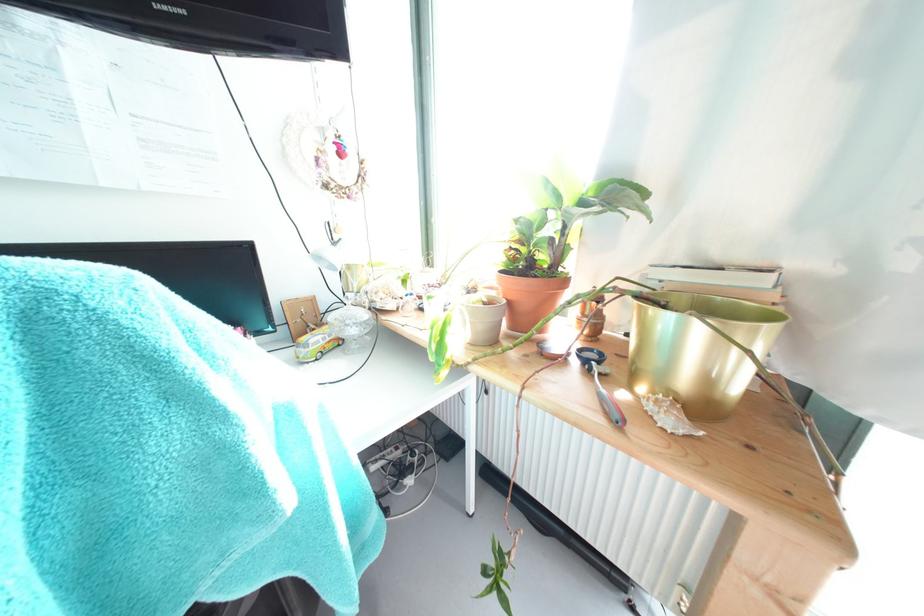
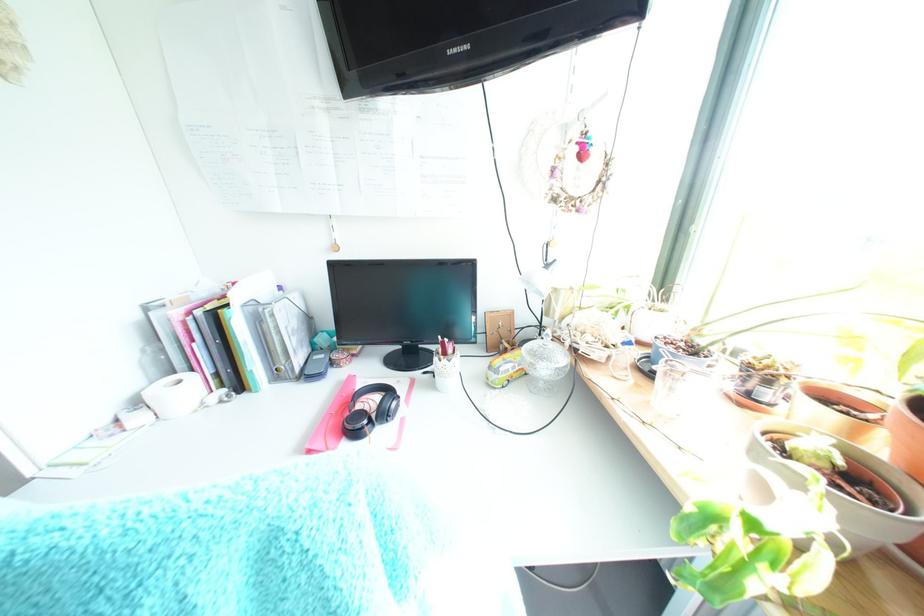
Question: The images are taken continuously from a first-person perspective. In which direction is your viewpoint rotating?

Choices:
 (A) Left
 (B) Right
 (C) Up
 (D) Down

Answer: (A)